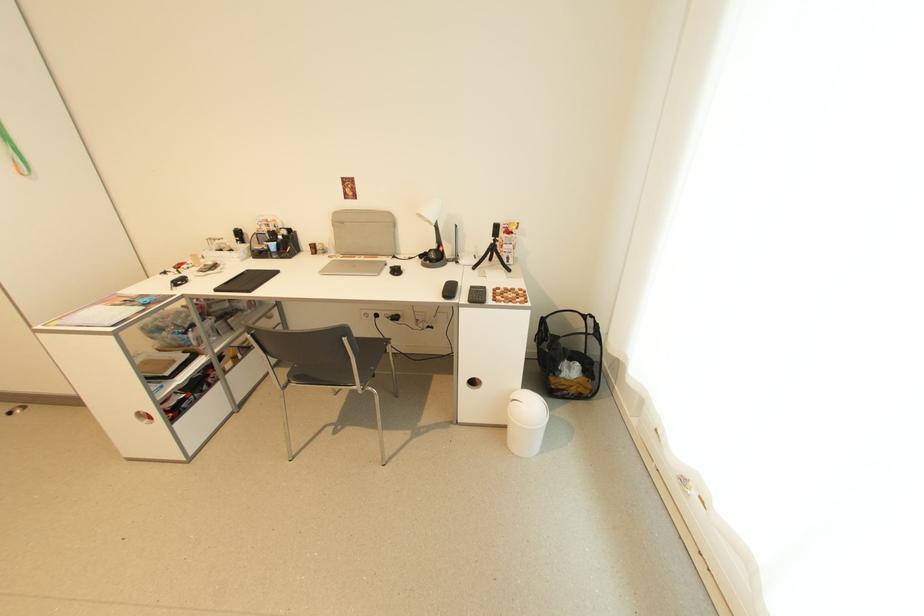
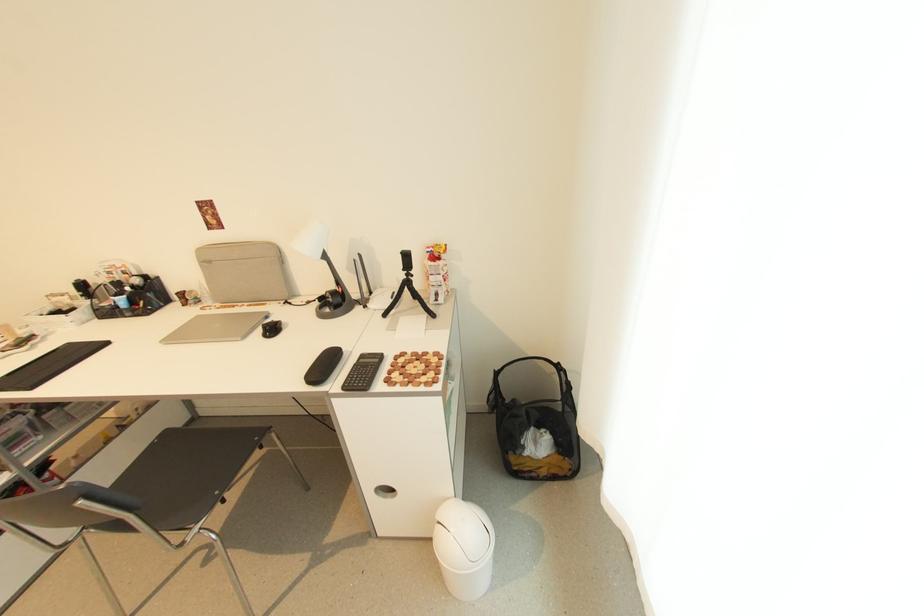
Which direction would the cameraman need to move to produce the second image?

The cameraman walked toward right, forward.